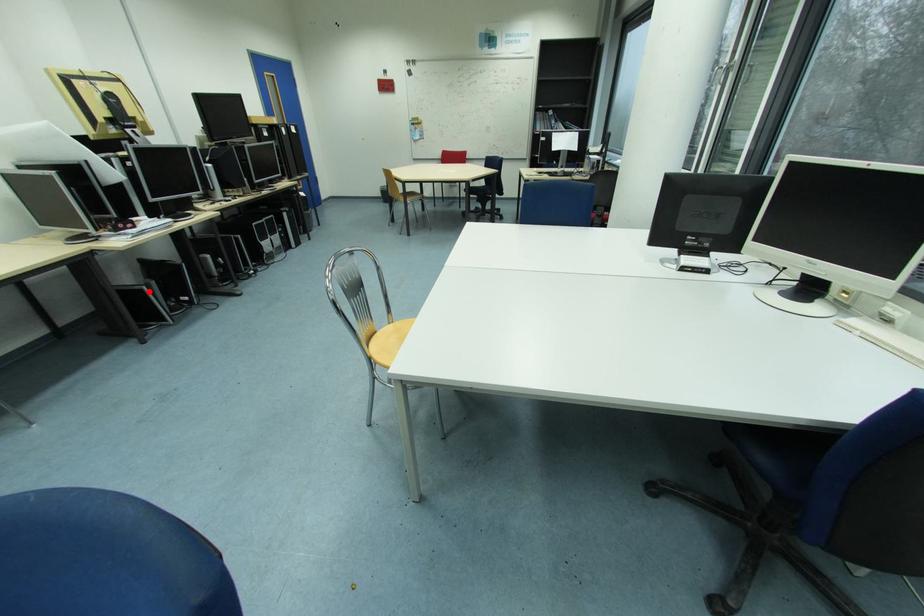
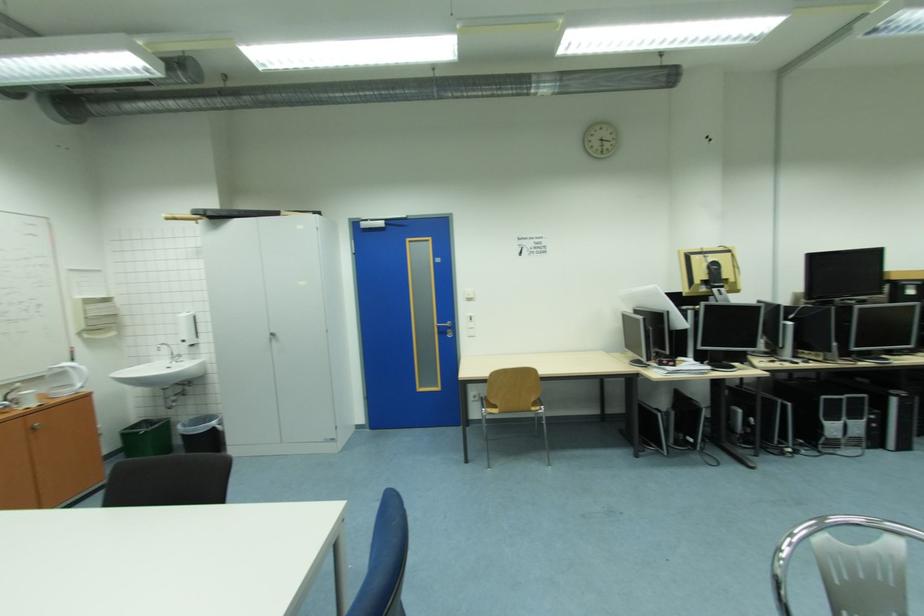
The point at the highlighted location is marked in the first image. Where is the corresponding point in the second image?

(663, 416)